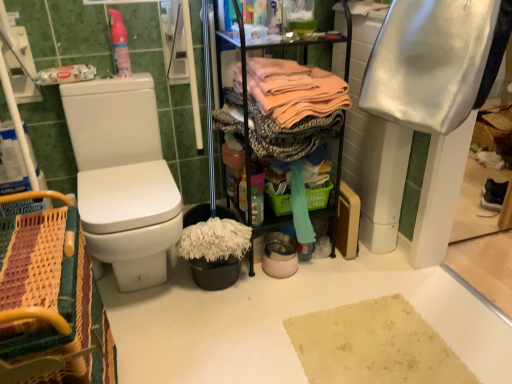
Question: Is white glossy toilet at left looking in the opposite direction of pink fabric at center, which ranks as the first clothing in left-to-right order?

Choices:
 (A) yes
 (B) no

Answer: (B)

Question: Is white glossy toilet at left located outside pink fabric at center, marked as the second clothing in a right-to-left arrangement?

Choices:
 (A) yes
 (B) no

Answer: (A)

Question: Does white glossy toilet at left come in front of pink fabric at center, marked as the second clothing in a right-to-left arrangement?

Choices:
 (A) yes
 (B) no

Answer: (A)

Question: From a real-world perspective, is white glossy toilet at left beneath pink fabric at center, marked as the second clothing in a right-to-left arrangement?

Choices:
 (A) no
 (B) yes

Answer: (B)

Question: Can you confirm if white glossy toilet at left is wider than pink fabric at center, which ranks as the first clothing in left-to-right order?

Choices:
 (A) no
 (B) yes

Answer: (B)

Question: Is point (417, 92) positioned closer to the camera than point (6, 253)?

Choices:
 (A) farther
 (B) closer

Answer: (A)

Question: Is white satin towel at upper right, which appears as the second clothing when viewed from the left, taller or shorter than woven wood picnic basket at lower left?

Choices:
 (A) tall
 (B) short

Answer: (B)

Question: Looking at the image, does white satin towel at upper right, which appears as the second clothing when viewed from the left, seem bigger or smaller compared to woven wood picnic basket at lower left?

Choices:
 (A) big
 (B) small

Answer: (B)

Question: Relative to woven wood picnic basket at lower left, is white satin towel at upper right, the first clothing from the right, in front or behind?

Choices:
 (A) behind
 (B) front

Answer: (A)

Question: From a real-world perspective, relative to black plastic bucket at lower center, is white glossy toilet at left vertically above or below?

Choices:
 (A) below
 (B) above

Answer: (B)

Question: From the image's perspective, is white glossy toilet at left located above or below black plastic bucket at lower center?

Choices:
 (A) below
 (B) above

Answer: (B)

Question: Is white glossy toilet at left spatially inside black plastic bucket at lower center, or outside of it?

Choices:
 (A) outside
 (B) inside

Answer: (A)

Question: In the image, is white glossy toilet at left on the left side or the right side of black plastic bucket at lower center?

Choices:
 (A) right
 (B) left

Answer: (B)

Question: Is woven wood picnic basket at lower left inside the boundaries of black plastic bucket at lower center, or outside?

Choices:
 (A) outside
 (B) inside

Answer: (A)

Question: Does point (37, 299) appear closer or farther from the camera than point (197, 221)?

Choices:
 (A) farther
 (B) closer

Answer: (B)